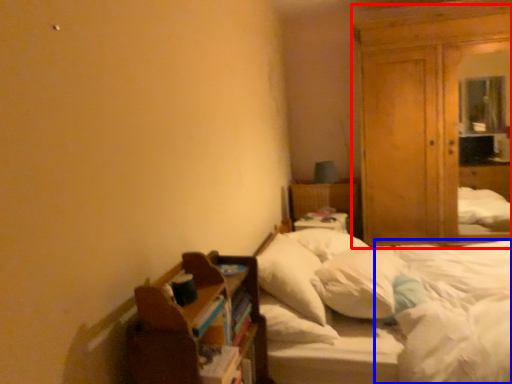
Question: Which object appears closest to the camera in this image, dresser (highlighted by a red box) or mattress (highlighted by a blue box)?

Choices:
 (A) dresser
 (B) mattress

Answer: (B)